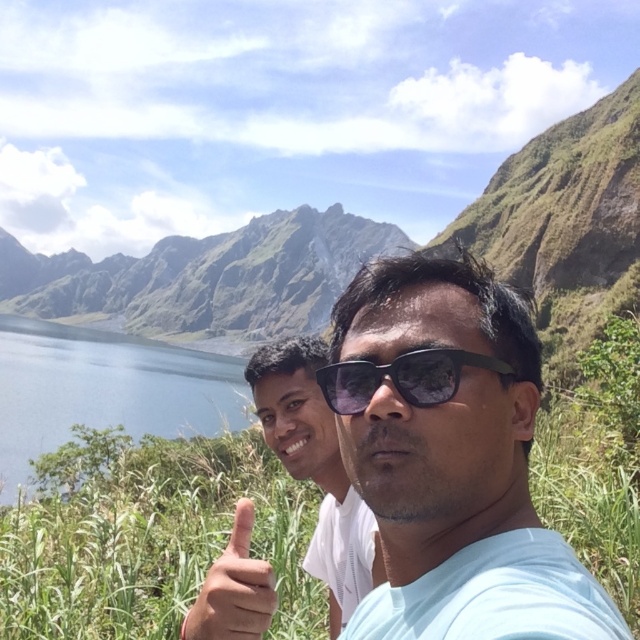
Which of these two, green leafy grass at lower left or green grassy mountain at center, stands shorter?

Standing shorter between the two is green leafy grass at lower left.

This screenshot has width=640, height=640. Describe the element at coordinates (147, 536) in the screenshot. I see `green leafy grass at lower left` at that location.

Find the location of a particular element. This screenshot has height=640, width=640. green leafy grass at lower left is located at coordinates (147, 536).

Does green grassy mountain at center appear over light skin tone flesh at center?

Indeed, green grassy mountain at center is positioned over light skin tone flesh at center.

Is point (186, 316) farther from camera compared to point (243, 582)?

Yes, point (186, 316) is farther from viewer.

Is point (268, 300) positioned in front of point (230, 636)?

No.

You are a GUI agent. You are given a task and a screenshot of the screen. Output one action in this format:
    pyautogui.click(x=<x>, y=<y>)
    Task: Click on the green grassy mountain at center
    This screenshot has width=640, height=640.
    Given the screenshot: What is the action you would take?
    pyautogui.click(x=205, y=280)

This screenshot has height=640, width=640. In order to click on green leafy grass at center in this screenshot , I will do `click(147, 536)`.

Between point (627, 540) and point (67, 586), which one is positioned behind?

Point (67, 586)

Does point (104, 440) come farther from viewer compared to point (100, 488)?

Yes, point (104, 440) is behind point (100, 488).

At what (x,y) coordinates should I click in order to perform the action: click on green leafy grass at center. Please return your answer as a coordinate pair (x, y). The width and height of the screenshot is (640, 640). Looking at the image, I should click on (147, 536).